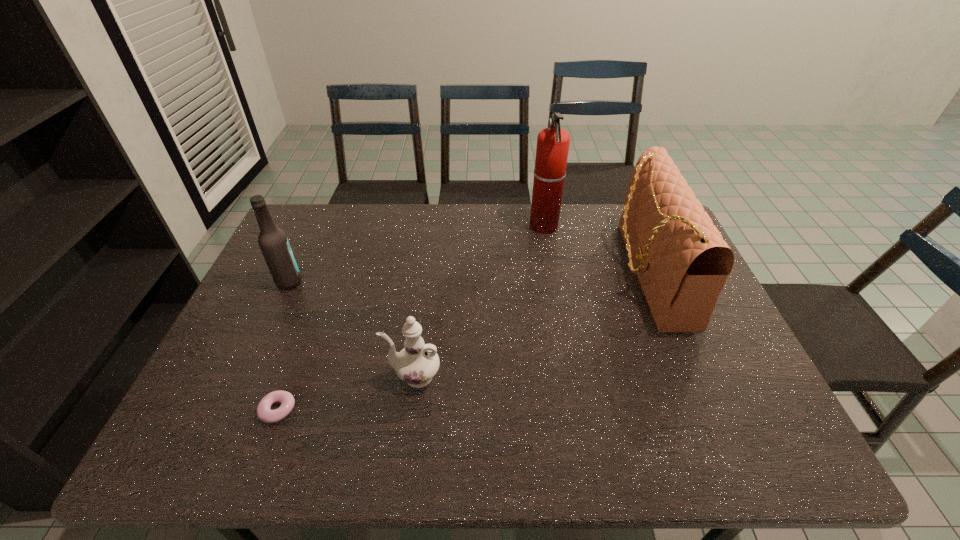
You are a GUI agent. You are given a task and a screenshot of the screen. Output one action in this format:
    pyautogui.click(x=<x>, y=<y>)
    Task: Click on the tallest object
    The width and height of the screenshot is (960, 540).
    Given the screenshot: What is the action you would take?
    pyautogui.click(x=553, y=143)

This screenshot has height=540, width=960. Identify the location of fire extinguisher. (553, 143).

At what (x,y) coordinates should I click in order to perform the action: click on the rightmost object. Please return your answer as a coordinate pair (x, y). This screenshot has width=960, height=540. Looking at the image, I should click on (682, 262).

Where is `the leftmost object`? The image size is (960, 540). the leftmost object is located at coordinates (273, 242).

Locate an element on the screen. the fourth tallest object is located at coordinates (416, 364).

I want to click on the third object from right to left, so click(416, 364).

The width and height of the screenshot is (960, 540). Find the location of `the second object from left to right`. the second object from left to right is located at coordinates (264, 413).

At what (x,y) coordinates should I click in order to perform the action: click on doughnut. Please return your answer as a coordinate pair (x, y). Looking at the image, I should click on (264, 413).

Locate an element on the screen. vacant position located 0.260m with the nozzle and gauge on the tallest object is located at coordinates (453, 227).

Identify the location of vacant area located 0.130m with the nozzle and gauge on the tallest object. (492, 227).